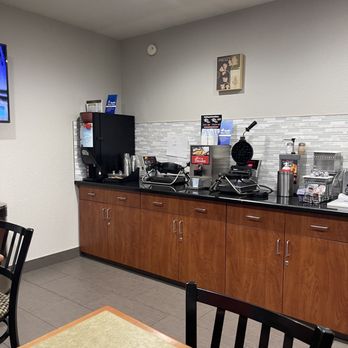
Image resolution: width=348 pixels, height=348 pixels. I want to click on cabinet handles, so click(103, 213), click(107, 214), click(172, 226), click(179, 228), click(277, 249), click(286, 249).